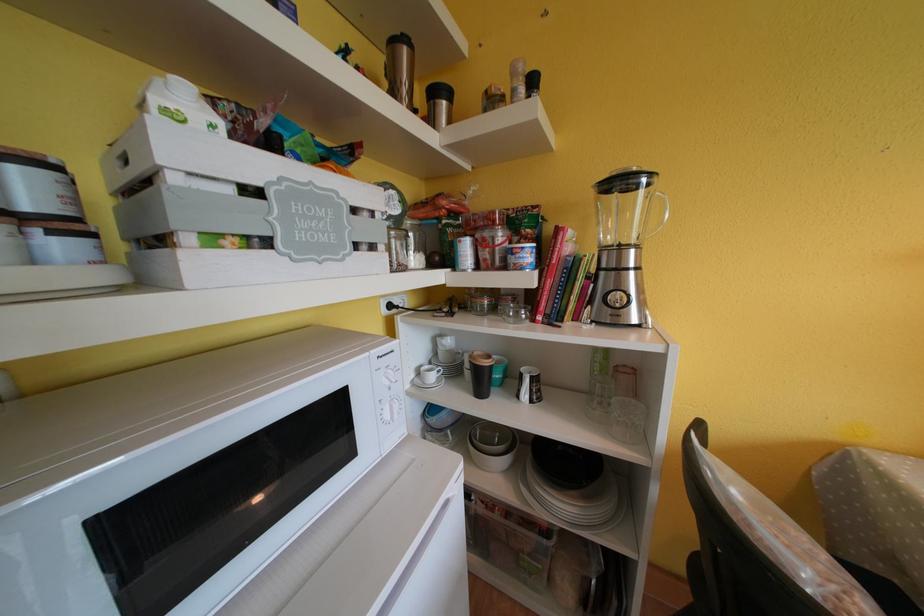
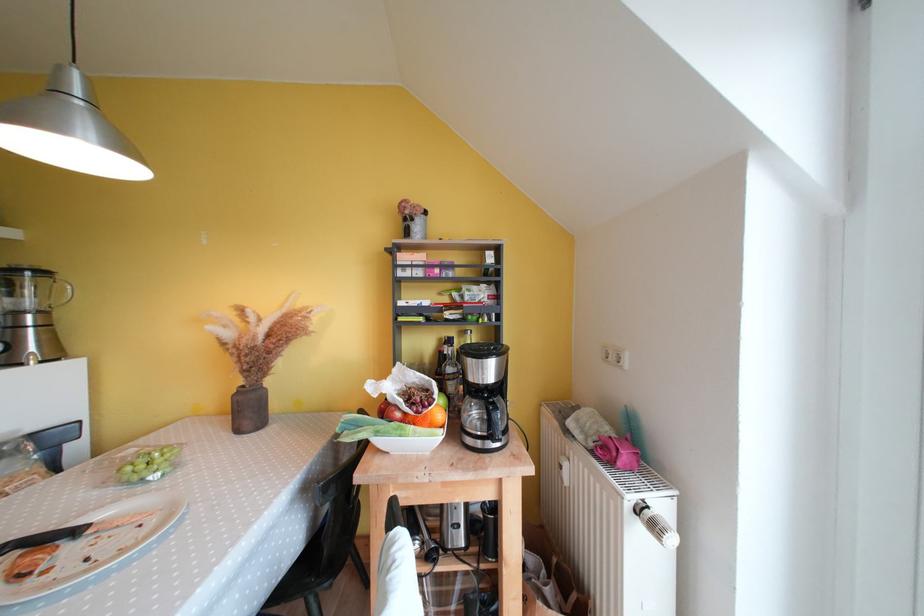
The point at (x=641, y=251) is marked in the first image. Where is the corresponding point in the second image?

(49, 315)